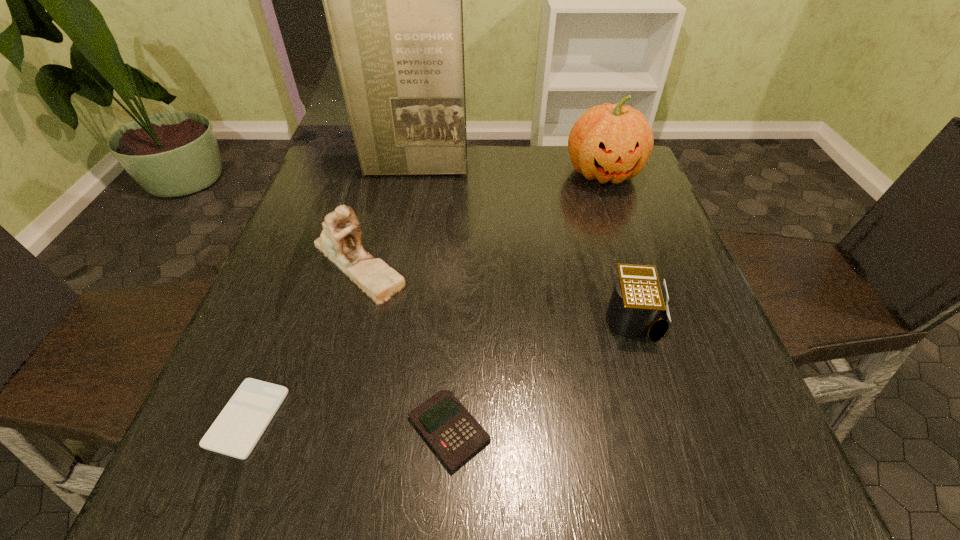
Where is `vacant point located between the second shortest object and the phonebook`? vacant point located between the second shortest object and the phonebook is located at coordinates (431, 299).

The height and width of the screenshot is (540, 960). Identify the location of free space that is in between the tallest calculator and the shortest object. (442, 368).

In order to click on empty space that is in between the rightmost calculator and the shortest object in this screenshot , I will do `click(442, 368)`.

In order to click on empty location between the third tallest object and the second tallest calculator in this screenshot , I will do `click(403, 347)`.

In order to click on free space between the phonebook and the leftmost calculator in this screenshot , I will do `click(330, 293)`.

At what (x,y) coordinates should I click in order to perform the action: click on free spot between the figurine and the fifth shortest object. Please return your answer as a coordinate pair (x, y). Looking at the image, I should click on (481, 218).

Where is `free space that is in between the fourth shortest object and the second tallest object`? This screenshot has width=960, height=540. free space that is in between the fourth shortest object and the second tallest object is located at coordinates (481, 218).

This screenshot has height=540, width=960. Find the location of `free space between the second calculator from right to left and the fourth shortest object`. free space between the second calculator from right to left and the fourth shortest object is located at coordinates (403, 347).

Locate an element on the screen. free spot between the farthest calculator and the second calculator from right to left is located at coordinates (542, 375).

What are the coordinates of `free point between the fifth tallest object and the phonebook` in the screenshot? It's located at (431, 299).